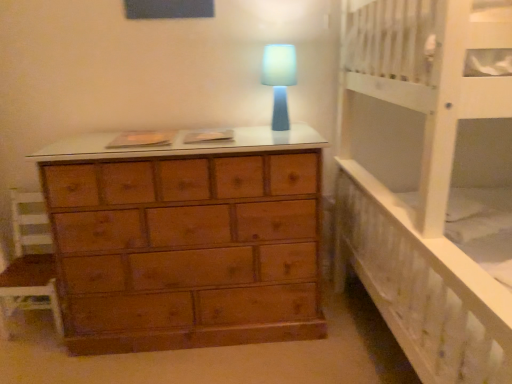
At what (x,y) coordinates should I click in order to perform the action: click on vacant space in front of wooden chair at left. Please return your answer as a coordinate pair (x, y). The height and width of the screenshot is (384, 512). Looking at the image, I should click on (35, 357).